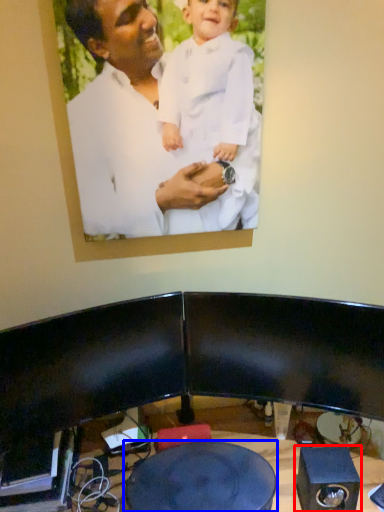
Question: Which object appears closest to the camera in this image, speaker (highlighted by a red box) or round table (highlighted by a blue box)?

Choices:
 (A) speaker
 (B) round table

Answer: (B)